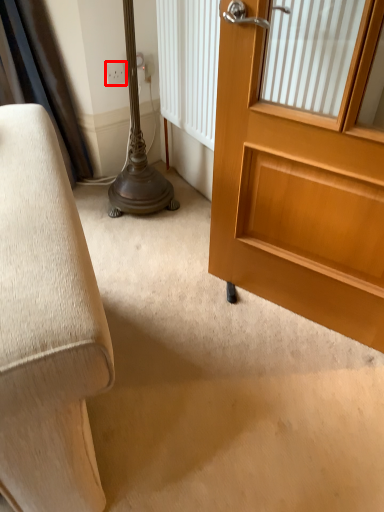
Question: Observing the image, what is the correct spatial positioning of electric outlet (annotated by the red box) in reference to door?

Choices:
 (A) right
 (B) left

Answer: (B)